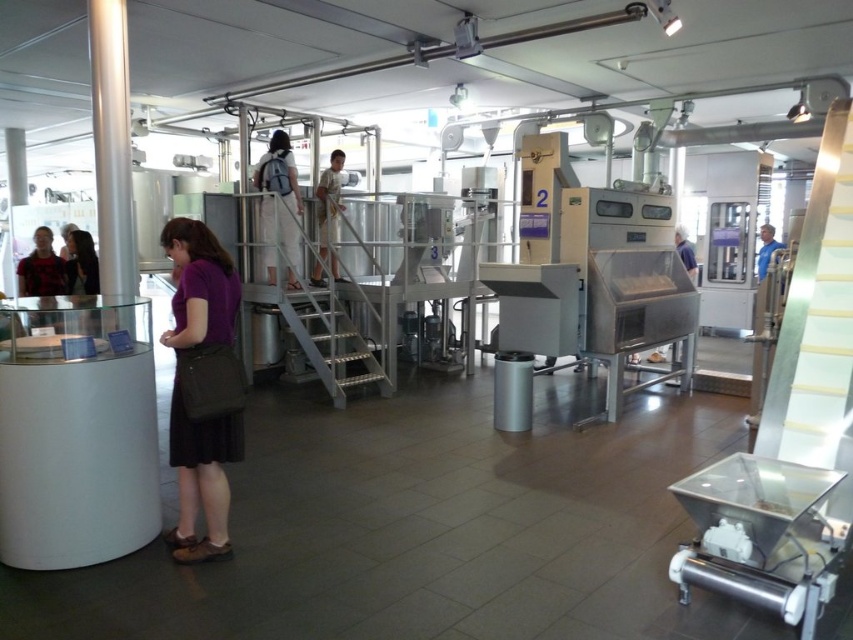
Is purple fabric dress at lower left closer to the viewer compared to white fabric dress at center?

Yes, it is in front of white fabric dress at center.

Does purple fabric dress at lower left have a greater height compared to white fabric dress at center?

Correct, purple fabric dress at lower left is much taller as white fabric dress at center.

Is point (233, 392) positioned in front of point (326, 224)?

Yes.

You are a GUI agent. You are given a task and a screenshot of the screen. Output one action in this format:
    pyautogui.click(x=<x>, y=<y>)
    Task: Click on the purple fabric dress at lower left
    This screenshot has height=640, width=853.
    Given the screenshot: What is the action you would take?
    click(202, 387)

Can you confirm if purple fabric dress at lower left is bigger than matte black shirt at left?

Correct, purple fabric dress at lower left is larger in size than matte black shirt at left.

Between purple fabric dress at lower left and matte black shirt at left, which one has less height?

Standing shorter between the two is matte black shirt at left.

Does point (189, 317) lie behind point (50, 280)?

No, (189, 317) is closer to viewer.

This screenshot has height=640, width=853. Find the location of `purple fabric dress at lower left`. purple fabric dress at lower left is located at coordinates (202, 387).

Is point (215, 365) farther from camera compared to point (767, 228)?

No.

Is purple fabric dress at lower left closer to the viewer compared to blue shirt at right?

Yes, purple fabric dress at lower left is closer to the viewer.

Which is behind, point (215, 264) or point (762, 243)?

Positioned behind is point (762, 243).

Image resolution: width=853 pixels, height=640 pixels. Identify the location of purple fabric dress at lower left. (202, 387).